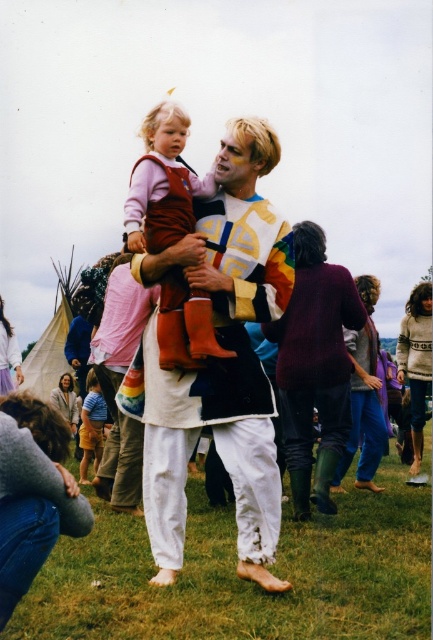
You are a photographer at the festival trying to capture the man and child in the center. You notice two points marked in the scene. Which point, point (171, 268) or point (93, 400), is closer to your camera lens?

Point (171, 268) is closer to the camera lens than point (93, 400).

You are a photographer at the festival trying to capture a candid shot of the man and child. You notice the white cotton pants at center and the striped cotton shirt at lower left in your viewfinder. Which clothing item appears higher in the frame?

The white cotton pants at center appears higher in the frame than the striped cotton shirt at lower left because the white cotton pants at center is above striped cotton shirt at lower left.